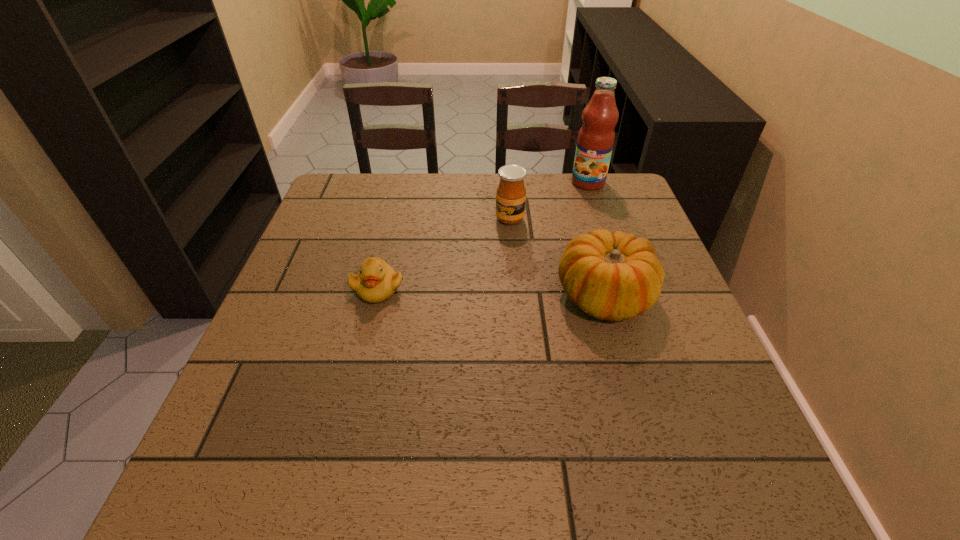
I want to click on object that is at the far right corner, so pyautogui.click(x=596, y=137).

In the image, there is a desktop. Where is `vacant space at the far edge`? The height and width of the screenshot is (540, 960). vacant space at the far edge is located at coordinates (542, 199).

Identify the location of vacant space at the near edge of the desktop. The image size is (960, 540). (359, 407).

In the image, there is a desktop. At what (x,y) coordinates should I click in order to perform the action: click on free space at the left edge. Please return your answer as a coordinate pair (x, y). The height and width of the screenshot is (540, 960). Looking at the image, I should click on (294, 287).

The width and height of the screenshot is (960, 540). What are the coordinates of `vacant space at the right edge of the desktop` in the screenshot? It's located at (609, 224).

This screenshot has width=960, height=540. I want to click on vacant area at the far left corner, so click(x=369, y=185).

The height and width of the screenshot is (540, 960). I want to click on free region at the near left corner, so click(x=279, y=421).

I want to click on free point at the far right corner, so click(x=622, y=195).

This screenshot has width=960, height=540. Identify the location of vacant region between the third object from right to left and the duckling. (444, 254).

Where is `empty space that is in between the honey and the tallest object`? empty space that is in between the honey and the tallest object is located at coordinates (549, 201).